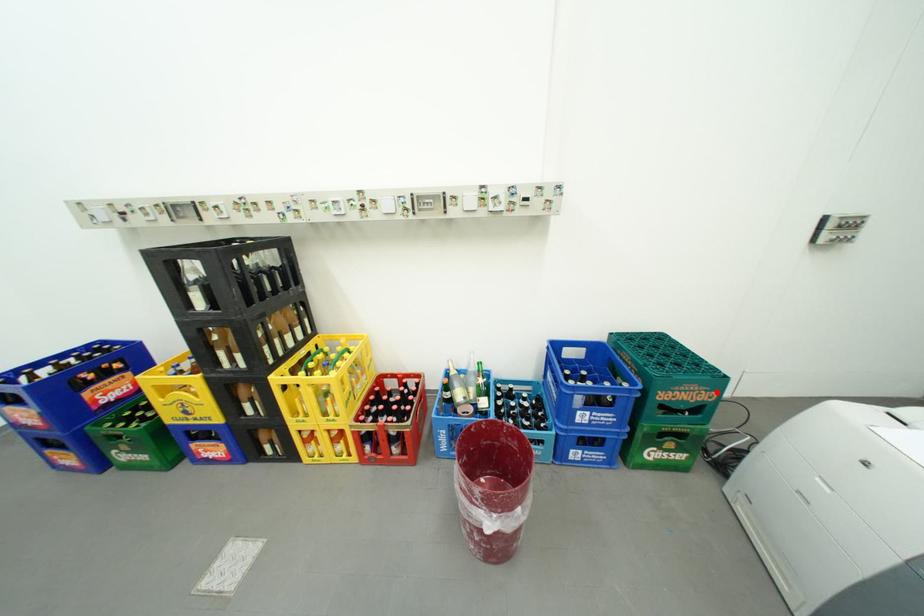
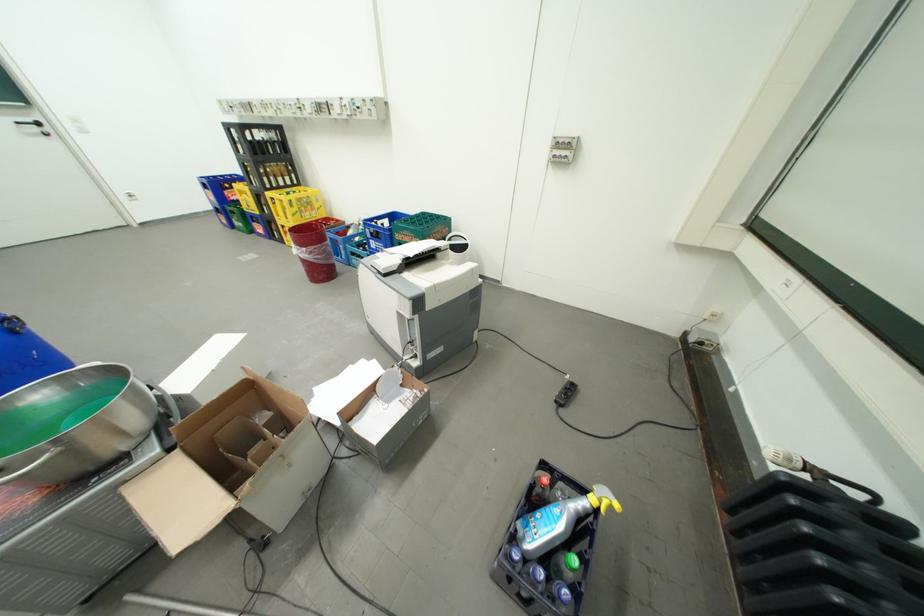
In the second image, find the point that corresponds to the highlighted location in the first image.

(424, 238)